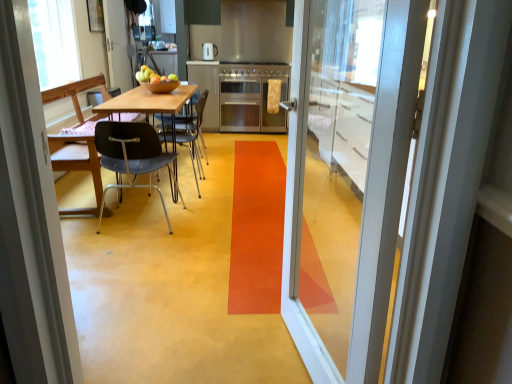
Question: From a real-world perspective, is transparent plastic window screen at upper left over satin silver refrigerator at center?

Choices:
 (A) yes
 (B) no

Answer: (A)

Question: Are transparent plastic window screen at upper left and satin silver refrigerator at center located far from each other?

Choices:
 (A) yes
 (B) no

Answer: (A)

Question: Considering the relative sizes of transparent plastic window screen at upper left and satin silver refrigerator at center in the image provided, is transparent plastic window screen at upper left shorter than satin silver refrigerator at center?

Choices:
 (A) yes
 (B) no

Answer: (A)

Question: Is satin silver refrigerator at center located within transparent plastic window screen at upper left?

Choices:
 (A) no
 (B) yes

Answer: (A)

Question: Is transparent plastic window screen at upper left smaller than satin silver refrigerator at center?

Choices:
 (A) yes
 (B) no

Answer: (B)

Question: Is transparent plastic window screen at upper left positioned in front of satin silver refrigerator at center?

Choices:
 (A) no
 (B) yes

Answer: (B)

Question: Is shiny brown bowl at center taller than satin silver refrigerator at center?

Choices:
 (A) yes
 (B) no

Answer: (B)

Question: Can you confirm if shiny brown bowl at center is positioned to the left of satin silver refrigerator at center?

Choices:
 (A) no
 (B) yes

Answer: (B)

Question: From the image's perspective, is shiny brown bowl at center over satin silver refrigerator at center?

Choices:
 (A) no
 (B) yes

Answer: (A)

Question: Considering the relative sizes of shiny brown bowl at center and satin silver refrigerator at center in the image provided, is shiny brown bowl at center thinner than satin silver refrigerator at center?

Choices:
 (A) no
 (B) yes

Answer: (B)

Question: Is shiny brown bowl at center shorter than satin silver refrigerator at center?

Choices:
 (A) no
 (B) yes

Answer: (B)

Question: From the image's perspective, does shiny brown bowl at center appear lower than satin silver refrigerator at center?

Choices:
 (A) no
 (B) yes

Answer: (B)

Question: Can you confirm if stainless steel stove at center is smaller than matte silver kettle at center?

Choices:
 (A) yes
 (B) no

Answer: (B)